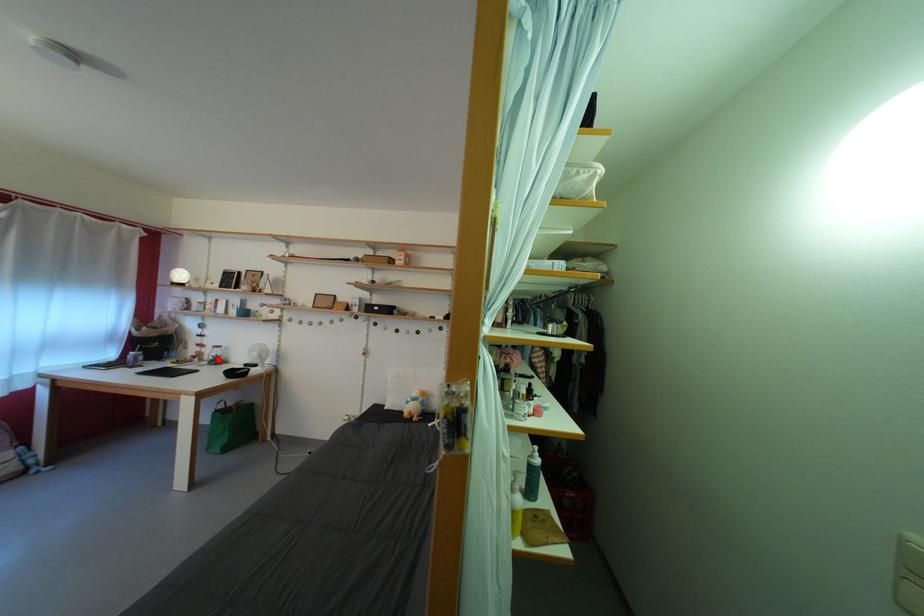
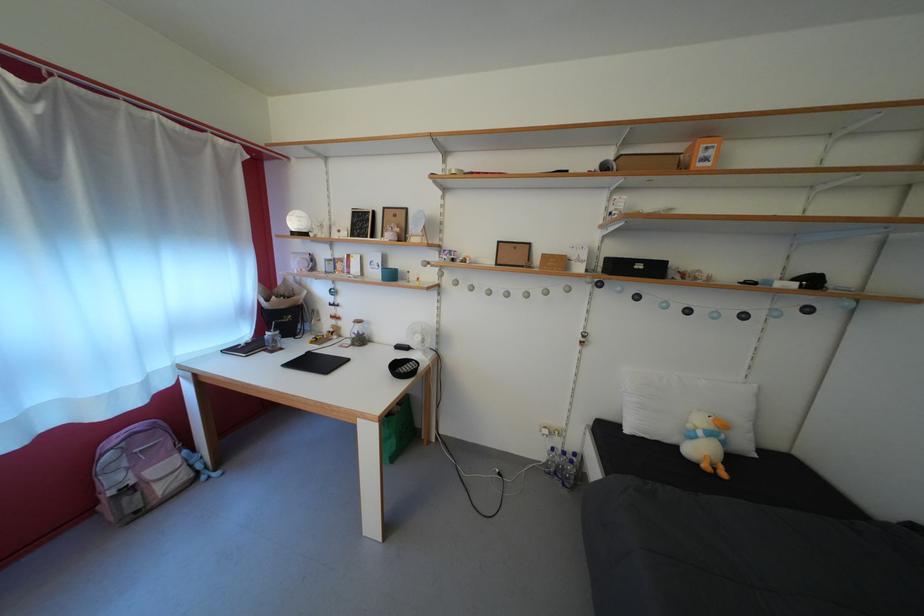
Question: A red point is marked in image1. In image2, is the corresponding 3D point closer to the camera or farther? Reply with the corresponding letter.

Choices:
 (A) The corresponding 3D point is closer.
 (B) The corresponding 3D point is farther.

Answer: (B)